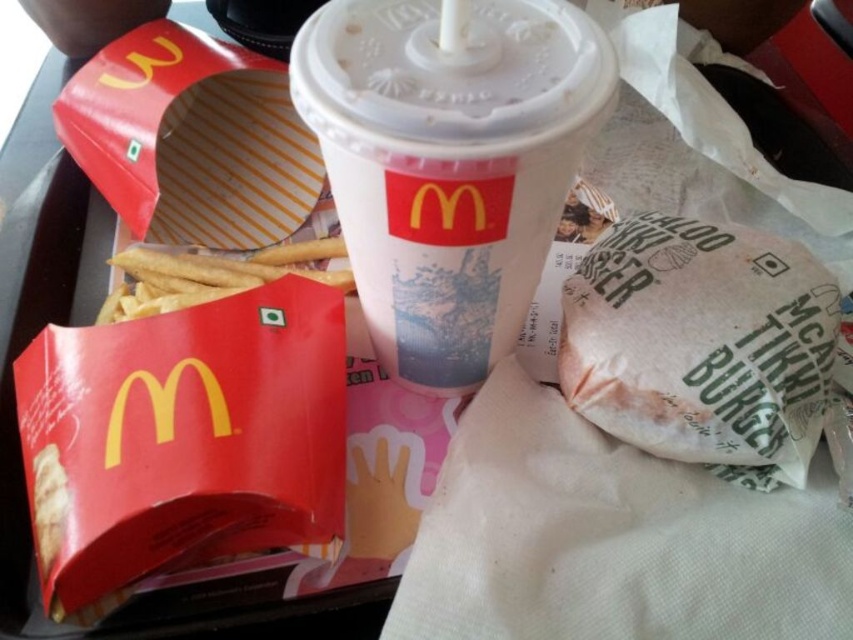
Who is positioned more to the right, white paper cup at center or white paper burger at lower right?

white paper burger at lower right is more to the right.

Does white paper cup at center have a smaller size compared to white paper burger at lower right?

No, white paper cup at center is not smaller than white paper burger at lower right.

Is point (474, 384) positioned behind point (718, 273)?

That is True.

You are a GUI agent. You are given a task and a screenshot of the screen. Output one action in this format:
    pyautogui.click(x=<x>, y=<y>)
    Task: Click on the white paper cup at center
    The height and width of the screenshot is (640, 853).
    Given the screenshot: What is the action you would take?
    (x=450, y=161)